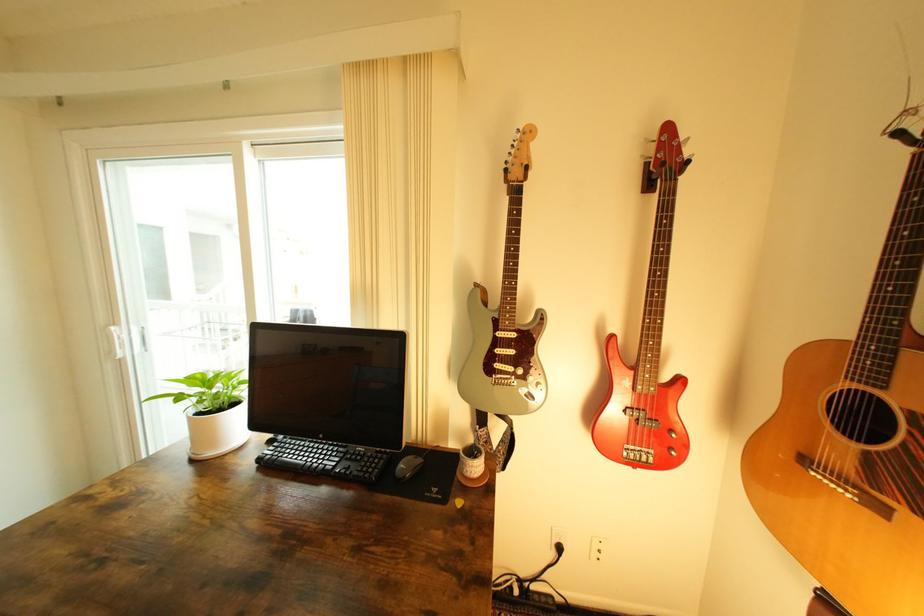
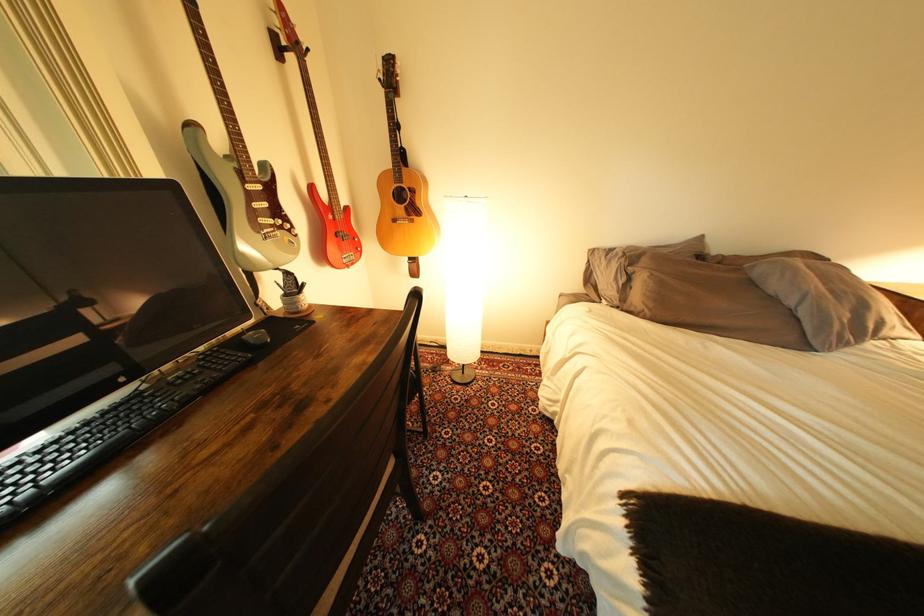
The point at (344, 460) is marked in the first image. Where is the corresponding point in the second image?

(171, 402)